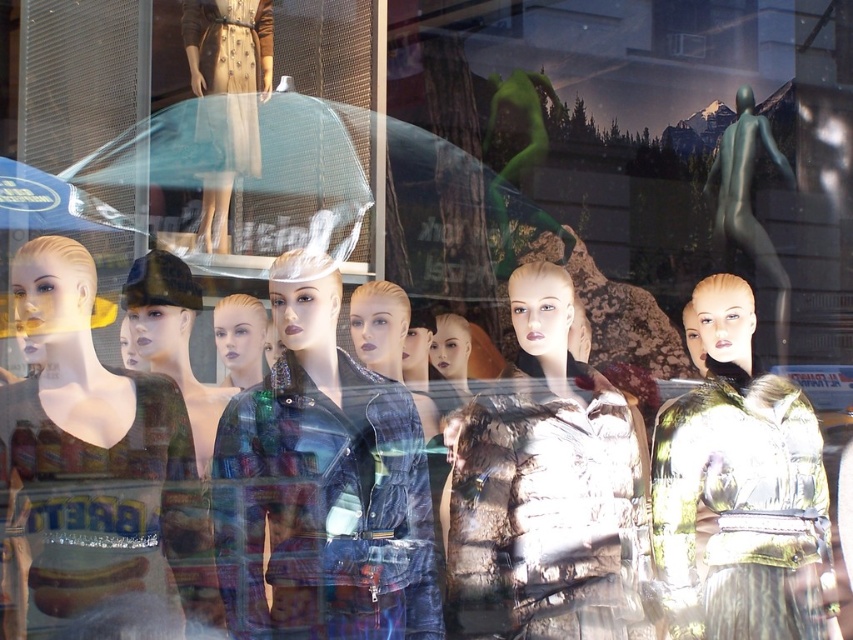
Can you confirm if metallic silver mannequin at upper right is bigger than matte black jacket at center?

Yes, metallic silver mannequin at upper right is bigger than matte black jacket at center.

Between metallic silver mannequin at upper right and matte black jacket at center, which one appears on the right side from the viewer's perspective?

Positioned to the right is metallic silver mannequin at upper right.

The image size is (853, 640). In order to click on metallic silver mannequin at upper right in this screenshot , I will do `click(747, 200)`.

Does metallic gold jacket at right have a greater height compared to matte black jacket at center?

Yes.

Is metallic gold jacket at right to the left of matte black jacket at center from the viewer's perspective?

No, metallic gold jacket at right is not to the left of matte black jacket at center.

Which is in front, point (659, 476) or point (247, 348)?

Point (659, 476)

The height and width of the screenshot is (640, 853). Find the location of `metallic gold jacket at right`. metallic gold jacket at right is located at coordinates (741, 490).

Can you confirm if plaid fabric jacket at center is positioned above matte beige dress at center?

No, plaid fabric jacket at center is not above matte beige dress at center.

Does plaid fabric jacket at center have a smaller size compared to matte beige dress at center?

Actually, plaid fabric jacket at center might be larger than matte beige dress at center.

Is point (289, 458) farther from camera compared to point (260, 60)?

No, it is in front of (260, 60).

This screenshot has width=853, height=640. In order to click on plaid fabric jacket at center in this screenshot , I will do `click(322, 484)`.